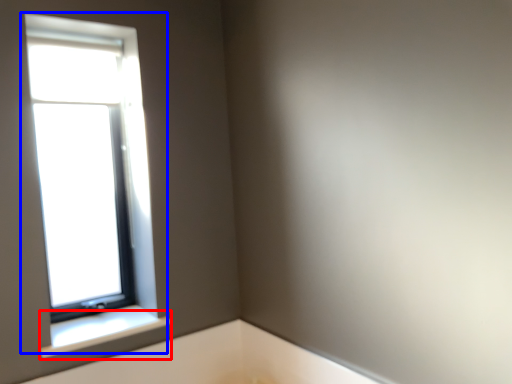
Question: Which object is closer to the camera taking this photo, window sill (highlighted by a red box) or window (highlighted by a blue box)?

Choices:
 (A) window sill
 (B) window

Answer: (A)